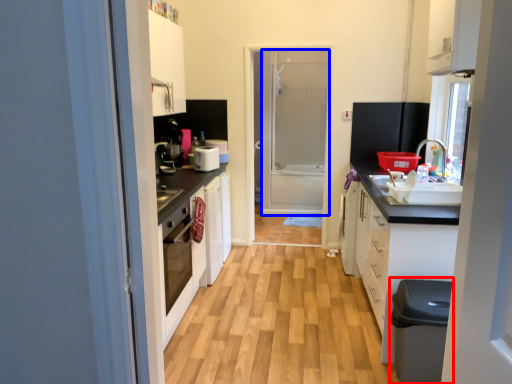
Question: Which object is closer to the camera taking this photo, dish washer (highlighted by a red box) or screen door (highlighted by a blue box)?

Choices:
 (A) dish washer
 (B) screen door

Answer: (A)